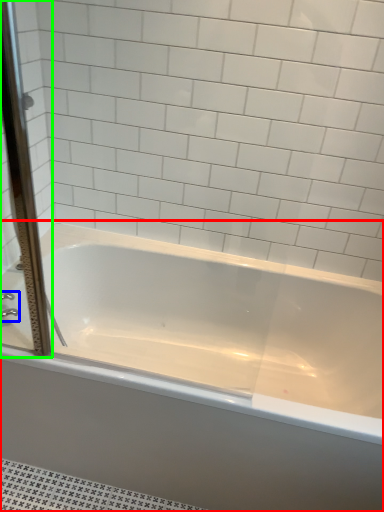
Question: Considering the real-world distances, which object is closest to bathtub (highlighted by a red box)? faucet (highlighted by a blue box) or screen door (highlighted by a green box).

Choices:
 (A) faucet
 (B) screen door

Answer: (B)